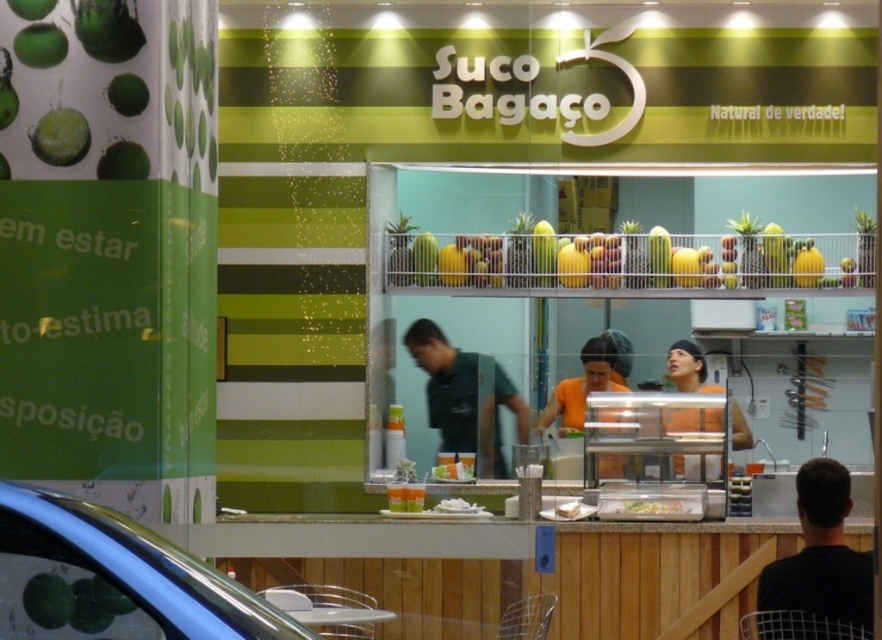
You are standing in front of the juice bar and see the metallic silver car at lower left and the orange fabric shirt at center. Which object is closer to you?

The metallic silver car at lower left is closer to you because it is in front of the orange fabric shirt at center.

You are a customer at the juice bar and want to order a fruit salad. The menu says you can choose between the green matte apple at upper left or the translucent plastic tray at center. Which option is bigger?

The translucent plastic tray at center is bigger than the green matte apple at upper left.

From the picture: You are standing in front of the juice bar and want to know which of the two points, point (832,572) or point (77,129), is closer to you. Based on the scene, which one is nearer?

Point (77,129) is closer to you because it is less further to the camera than point (832,572).